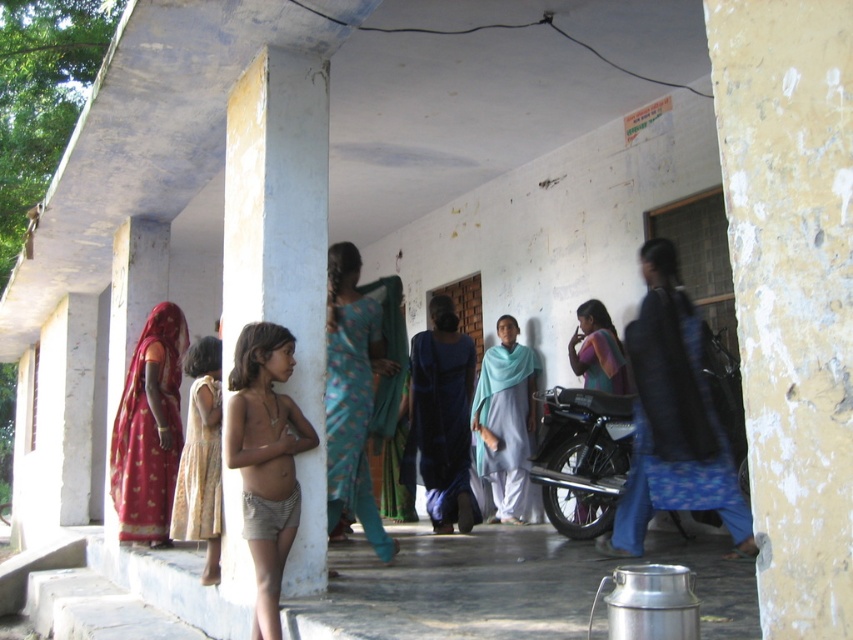
Question: Which object is closer to the camera taking this photo?

Choices:
 (A) tan fabric shorts at left
 (B) light blue cotton dress at center
 (C) teal printed saree at center

Answer: (A)

Question: Considering the real-world distances, which object is closest to the tan fabric shorts at left?

Choices:
 (A) light blue cotton dress at center
 (B) blue fabric shawl at center

Answer: (B)

Question: Does teal printed saree at center appear under matte red sari at left?

Choices:
 (A) yes
 (B) no

Answer: (B)

Question: Which is farther from the teal printed saree at center?

Choices:
 (A) blue fabric shawl at center
 (B) yellow textured wall at right
 (C) white smooth pillar at center

Answer: (B)

Question: From the image, what is the correct spatial relationship of white smooth pillar at center in relation to light beige fabric dress at left?

Choices:
 (A) below
 (B) above

Answer: (B)

Question: Does white smooth pillar at center appear on the left side of teal fabric scarf at center?

Choices:
 (A) no
 (B) yes

Answer: (B)